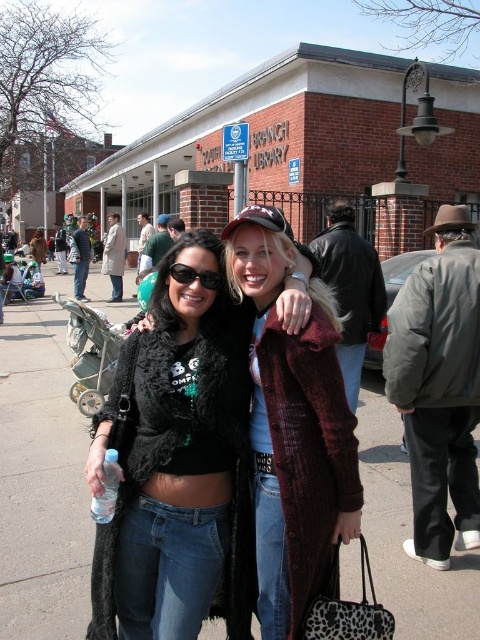
Question: Is clear plastic bottle at lower left to the left of sunglasses at center from the viewer's perspective?

Choices:
 (A) yes
 (B) no

Answer: (A)

Question: Among these objects, which one is farthest from the camera?

Choices:
 (A) black fuzzy cardigan at center
 (B) matte concrete sidewalk at center
 (C) clear plastic bottle at lower left
 (D) dark gray puffer jacket at right

Answer: (D)

Question: Which point appears farthest from the camera in this image?

Choices:
 (A) (472, 372)
 (B) (181, 266)
 (C) (160, 374)

Answer: (A)

Question: Which object appears farthest from the camera in this image?

Choices:
 (A) matte concrete sidewalk at center
 (B) black fuzzy cardigan at center
 (C) sunglasses at center
 (D) dark gray puffer jacket at right

Answer: (D)

Question: Is black fuzzy cardigan at center positioned in front of dark gray puffer jacket at right?

Choices:
 (A) no
 (B) yes

Answer: (B)

Question: Considering the relative positions of matte concrete sidewalk at center and clear plastic bottle at lower left in the image provided, where is matte concrete sidewalk at center located with respect to clear plastic bottle at lower left?

Choices:
 (A) right
 (B) left

Answer: (B)